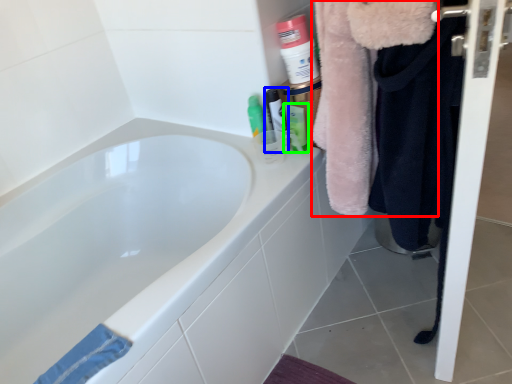
Question: Which object is positioned closest to fur coat (highlighted by a red box)? Select from mouthwash (highlighted by a blue box) and mouthwash (highlighted by a green box).

Choices:
 (A) mouthwash
 (B) mouthwash

Answer: (B)